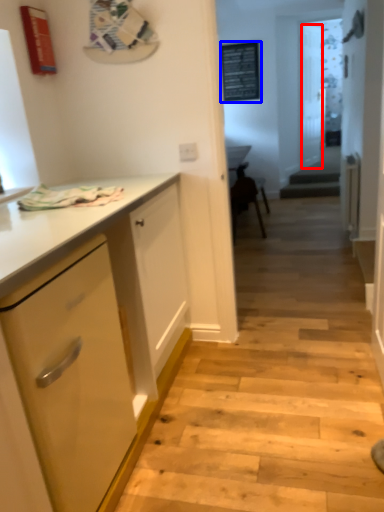
Question: Which of the following is the farthest to the observer, glass door (highlighted by a red box) or bulletin board (highlighted by a blue box)?

Choices:
 (A) glass door
 (B) bulletin board

Answer: (A)